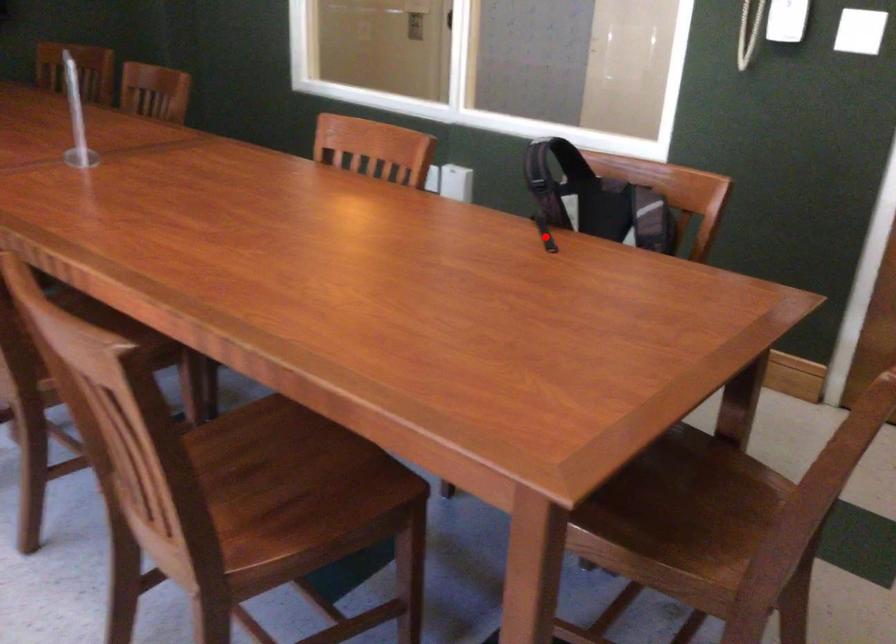
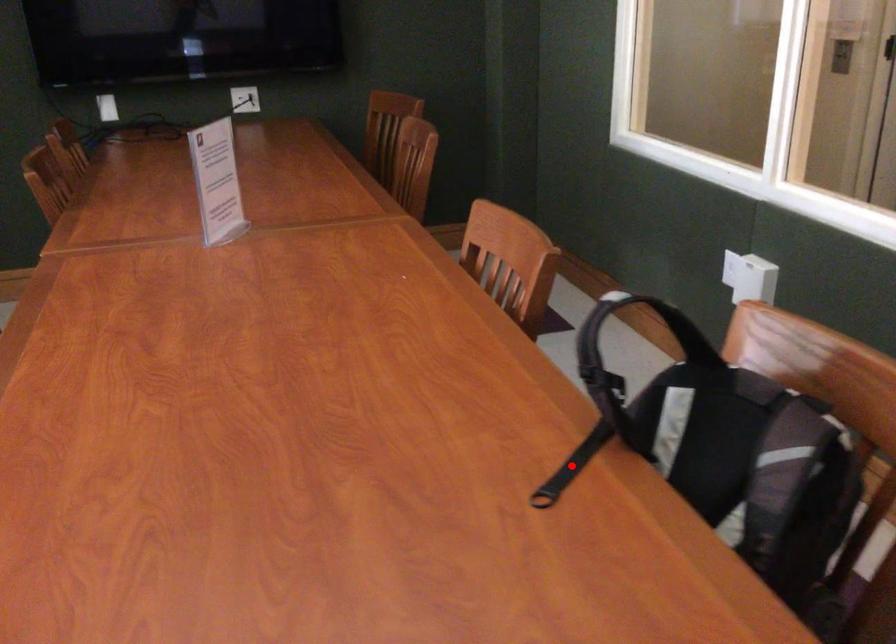
In the scene shown: I am providing you with two images of the same scene from different viewpoints. A red point is marked on the first image and another point is marked on the second image. Are the points marked in image1 and image2 representing the same 3D position?

Yes